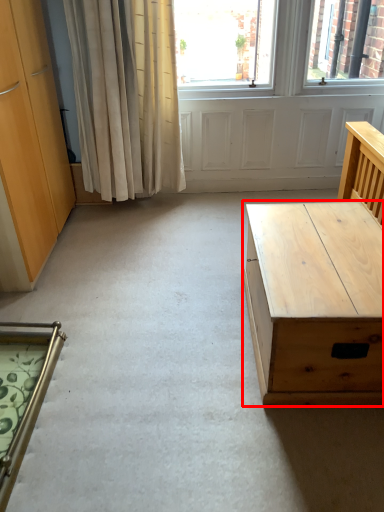
Question: Considering the relative positions of desk (annotated by the red box) and chair in the image provided, where is desk (annotated by the red box) located with respect to the staircase?

Choices:
 (A) left
 (B) right

Answer: (B)